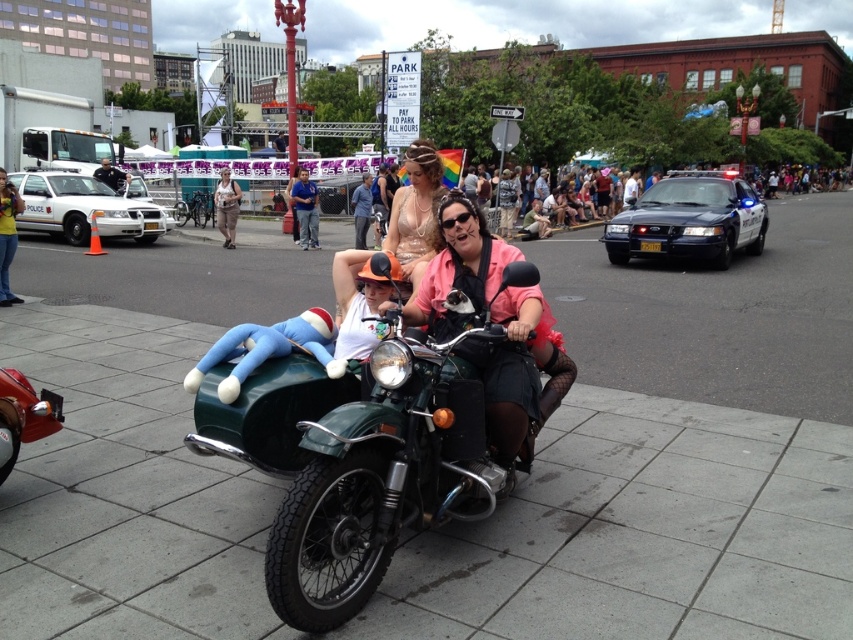
You are a photographer trying to capture a photo of the green matte motorcycle at center and the matte beige dress at center. From your current position, which object is positioned to the right of the other?

The green matte motorcycle at center is to the right of the matte beige dress at center, so the motorcycle is positioned to the right of the dress.

You are a photographer trying to capture a photo of the green matte motorcycle at center and the shiny gold dress at center from the front. Which object should you focus on first to ensure both are in frame?

The green matte motorcycle at center is positioned on the right side of the shiny gold dress at center. To capture both in frame, focus on the shiny gold dress at center first as it is on the left, then adjust to include the motorcycle on the right.